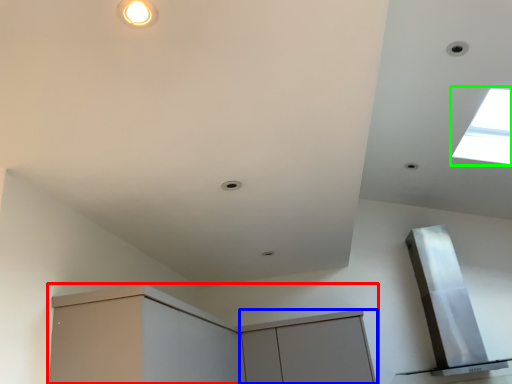
Question: Estimate the real-world distances between objects in this image. Which object is closer to cabinetry (highlighted by a red box), cabinetry (highlighted by a blue box) or window (highlighted by a green box)?

Choices:
 (A) cabinetry
 (B) window

Answer: (A)